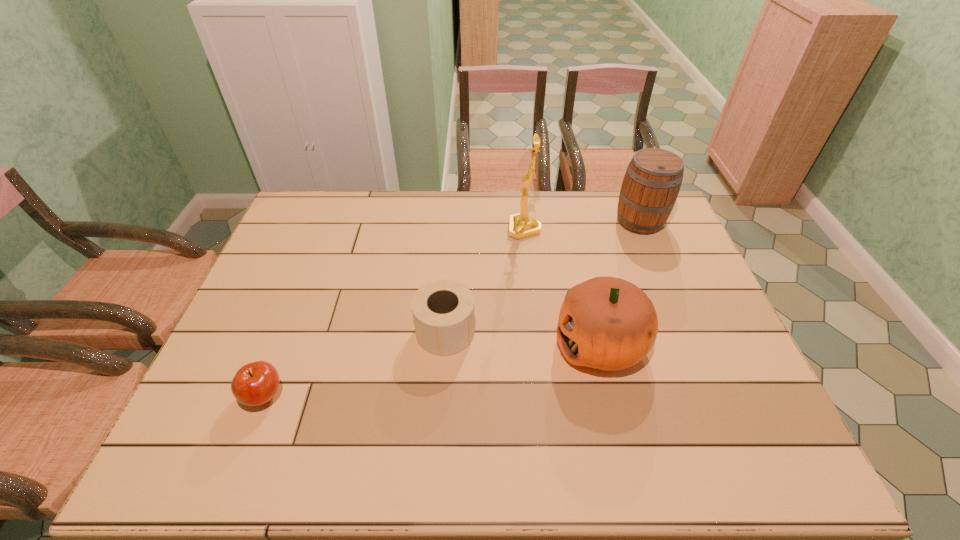
This screenshot has width=960, height=540. In order to click on free point between the third tallest object and the shortest object in this screenshot , I will do `click(432, 369)`.

Where is `vacant space in between the apple and the third tallest object`? This screenshot has width=960, height=540. vacant space in between the apple and the third tallest object is located at coordinates (432, 369).

You are a GUI agent. You are given a task and a screenshot of the screen. Output one action in this format:
    pyautogui.click(x=<x>, y=<y>)
    Task: Click on the free space between the second object from left to right and the third shortest object
    
    Given the screenshot: What is the action you would take?
    pyautogui.click(x=523, y=338)

Where is `vacant space that is in between the tallest object and the third tallest object`? This screenshot has width=960, height=540. vacant space that is in between the tallest object and the third tallest object is located at coordinates (563, 286).

You are a GUI agent. You are given a task and a screenshot of the screen. Output one action in this format:
    pyautogui.click(x=<x>, y=<y>)
    Task: Click on the free point between the tallest object and the fourth object from right to left
    Image resolution: width=960 pixels, height=540 pixels.
    Given the screenshot: What is the action you would take?
    pyautogui.click(x=485, y=280)

Choose which object is the second nearest neighbor to the shortest object. Please provide its 2D coordinates. Your answer should be formatted as a tuple, i.e. [(x, y)], where the tuple contains the x and y coordinates of a point satisfying the conditions above.

[(607, 323)]

Select which object is the second closest to the award. Please provide its 2D coordinates. Your answer should be formatted as a tuple, i.e. [(x, y)], where the tuple contains the x and y coordinates of a point satisfying the conditions above.

[(607, 323)]

Locate an element on the screen. This screenshot has height=540, width=960. free point that satisfies the following two spatial constraints: 1. on the front-facing side of the award; 2. on the front side of the shortest object is located at coordinates (543, 396).